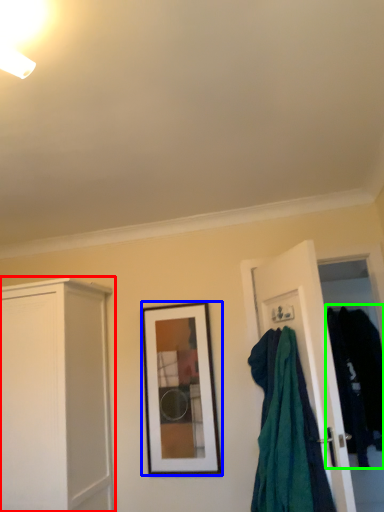
Question: Which object is the closest to the cabinetry (highlighted by a red box)? Choose among these: picture frame (highlighted by a blue box) or clothing (highlighted by a green box).

Choices:
 (A) picture frame
 (B) clothing

Answer: (A)